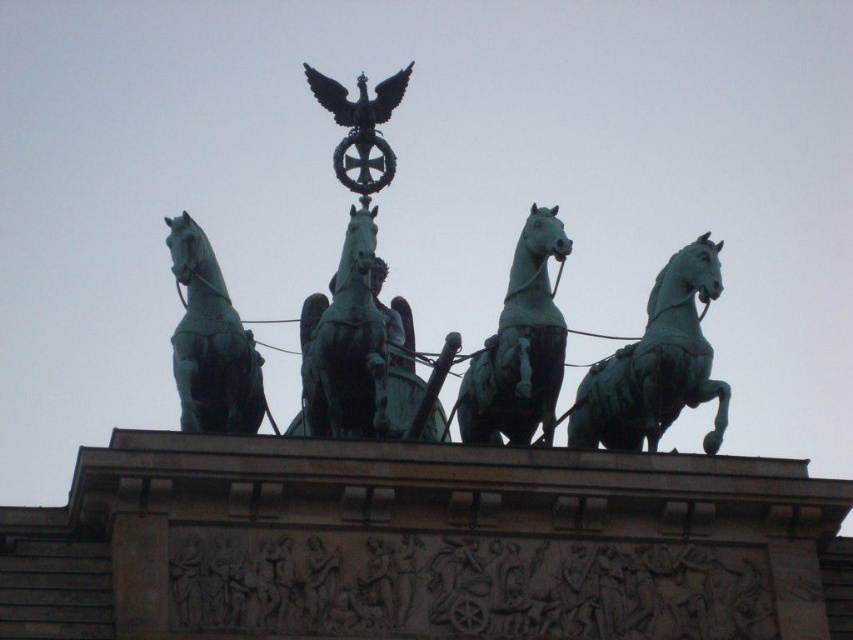
Question: Among these objects, which one is nearest to the camera?

Choices:
 (A) green polished metal horse at center
 (B) green polished bronze chariot at center

Answer: (B)

Question: Can you confirm if green polished bronze chariot at center is positioned to the left of green polished metal horse at right?

Choices:
 (A) no
 (B) yes

Answer: (B)

Question: Considering the relative positions of green polished metal horse at right and green polished metal horse at left in the image provided, where is green polished metal horse at right located with respect to green polished metal horse at left?

Choices:
 (A) left
 (B) right

Answer: (B)

Question: Does green polished metal horse at right have a smaller size compared to green polished metal horse at left?

Choices:
 (A) no
 (B) yes

Answer: (A)

Question: Estimate the real-world distances between objects in this image. Which object is farther from the green polished bronze chariot at center?

Choices:
 (A) green polished metal horse at left
 (B) green polished metal horse at right

Answer: (B)

Question: Considering the real-world distances, which object is farthest from the green polished metal horse at right?

Choices:
 (A) green polished metal horse at center
 (B) green polished bronze chariot at center

Answer: (B)